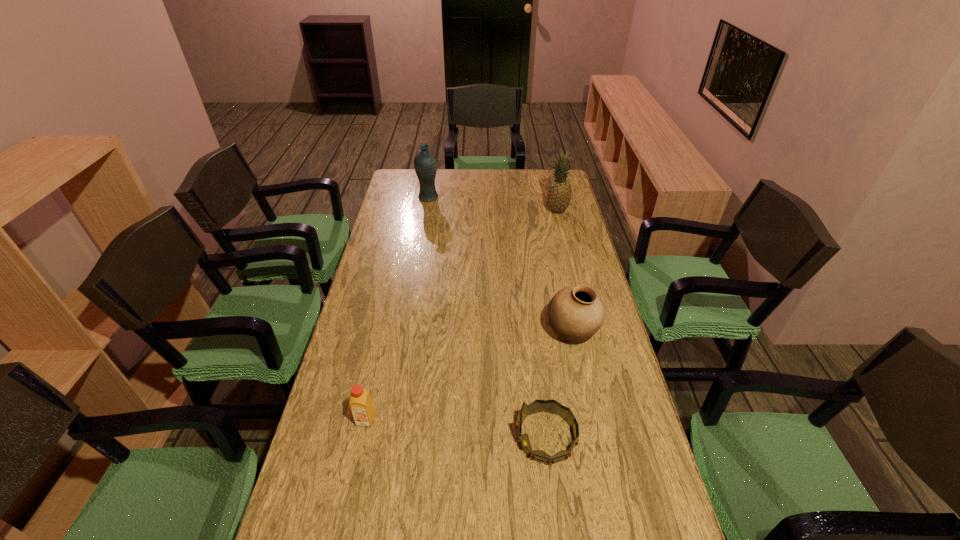
You are a GUI agent. You are given a task and a screenshot of the screen. Output one action in this format:
    pyautogui.click(x=<x>, y=<y>)
    Task: Click on the second farthest object
    This screenshot has width=960, height=540.
    Given the screenshot: What is the action you would take?
    pyautogui.click(x=559, y=194)

Where is `the farthest object`? The height and width of the screenshot is (540, 960). the farthest object is located at coordinates (425, 162).

Locate an element on the screen. the third nearest object is located at coordinates (575, 313).

Identify the location of pottery. (575, 313).

Locate an element on the screen. This screenshot has width=960, height=540. orange juice is located at coordinates (360, 403).

Locate an element on the screen. the shortest object is located at coordinates (551, 406).

Where is `vacant space located on the left of the fourth nearest object`? This screenshot has width=960, height=540. vacant space located on the left of the fourth nearest object is located at coordinates (475, 211).

You are a GUI agent. You are given a task and a screenshot of the screen. Output one action in this format:
    pyautogui.click(x=<x>, y=<y>)
    Task: Click on the free space located on the back of the farthest object
    This screenshot has height=540, width=960.
    Given the screenshot: What is the action you would take?
    pyautogui.click(x=432, y=176)

I want to click on free region located on the left of the pottery, so click(x=517, y=333).

The image size is (960, 540). What are the coordinates of `vacant region located on the front and back of the orange juice` in the screenshot? It's located at (340, 539).